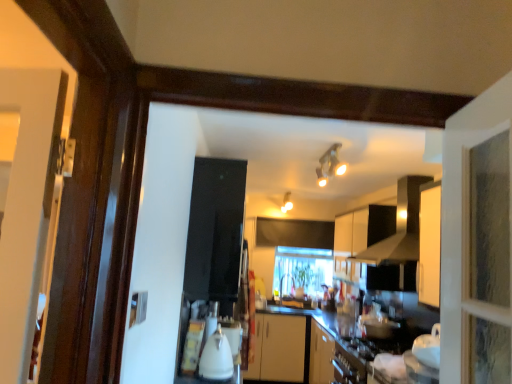
What are the coordinates of `black matte exhaust hood at upper center` in the screenshot? It's located at (400, 227).

What is the approximate height of black matte exhaust hood at upper center?

29.12 inches.

Image resolution: width=512 pixels, height=384 pixels. I want to click on white matte cabinet at upper center, so click(x=360, y=236).

What do you see at coordinates (216, 358) in the screenshot? I see `white glossy kettle at center` at bounding box center [216, 358].

How much space does matte silver light fixture at upper center, the 2th light fixture from the back, occupy vertically?

The height of matte silver light fixture at upper center, the 2th light fixture from the back, is 16.30 centimeters.

Where is `black matte exhaust hood at upper center`? This screenshot has width=512, height=384. black matte exhaust hood at upper center is located at coordinates (400, 227).

Is black matte exhaust hood at upper center in front of or behind matte white light fixture at upper center, acting as the second light fixture starting from the top, in the image?

Clearly, black matte exhaust hood at upper center is in front of matte white light fixture at upper center, acting as the second light fixture starting from the top.

Can you confirm if black matte exhaust hood at upper center is smaller than matte white light fixture at upper center, acting as the 2th light fixture starting from the right?

No.

Which object is wider, black matte exhaust hood at upper center or matte white light fixture at upper center, acting as the second light fixture starting from the top?

matte white light fixture at upper center, acting as the second light fixture starting from the top, is wider.

Is point (303, 284) closer to camera compared to point (227, 374)?

That is False.

From a real-world perspective, is clear glass window at center positioned over white glossy kettle at center based on gravity?

Yes, from a real-world perspective, clear glass window at center is over white glossy kettle at center

Is clear glass window at center next to white glossy kettle at center and touching it?

No, clear glass window at center is not in contact with white glossy kettle at center.

Based on their positions, is clear glass window at center located to the left or right of white glossy kettle at center?

In the image, clear glass window at center appears on the right side of white glossy kettle at center.

This screenshot has height=384, width=512. Find the location of `light fixture in front of the white matte cabinet at upper center`. light fixture in front of the white matte cabinet at upper center is located at coordinates (330, 165).

Between white matte cabinet at upper center and matte silver light fixture at upper center, the 2th light fixture from the back, which one appears on the left side from the viewer's perspective?

Positioned to the left is matte silver light fixture at upper center, the 2th light fixture from the back.

Does point (339, 218) lie behind point (343, 165)?

Yes.

Who is shorter, matte white light fixture at upper center, acting as the 2th light fixture starting from the right, or black matte exhaust hood at upper center?

Standing shorter between the two is matte white light fixture at upper center, acting as the 2th light fixture starting from the right.

Is matte white light fixture at upper center, the 1th light fixture in the back-to-front sequence, thinner than black matte exhaust hood at upper center?

In fact, matte white light fixture at upper center, the 1th light fixture in the back-to-front sequence, might be wider than black matte exhaust hood at upper center.

In the image, is matte white light fixture at upper center, the first light fixture in the left-to-right sequence, positioned in front of or behind black matte exhaust hood at upper center?

In the image, matte white light fixture at upper center, the first light fixture in the left-to-right sequence, appears behind black matte exhaust hood at upper center.

Which is correct: matte white light fixture at upper center, acting as the 2th light fixture starting from the right, is inside black matte exhaust hood at upper center, or outside of it?

matte white light fixture at upper center, acting as the 2th light fixture starting from the right, lies outside black matte exhaust hood at upper center.

Which of these two, white glossy kettle at center or matte white light fixture at upper center, arranged as the second light fixture when viewed from the front, stands taller?

white glossy kettle at center is taller.

Can you confirm if white glossy kettle at center is smaller than matte white light fixture at upper center, acting as the second light fixture starting from the top?

Correct, white glossy kettle at center occupies less space than matte white light fixture at upper center, acting as the second light fixture starting from the top.

Between white glossy kettle at center and matte white light fixture at upper center, the first light fixture when ordered from bottom to top, which one appears on the right side from the viewer's perspective?

matte white light fixture at upper center, the first light fixture when ordered from bottom to top, is more to the right.

Is white glossy kettle at center positioned far away from matte white light fixture at upper center, arranged as the second light fixture when viewed from the front?

Yes, white glossy kettle at center and matte white light fixture at upper center, arranged as the second light fixture when viewed from the front, are quite far apart.

From the picture: Which is more to the left, white glossy kettle at center or black matte exhaust hood at upper center?

Positioned to the left is white glossy kettle at center.

Does white glossy kettle at center have a smaller size compared to black matte exhaust hood at upper center?

Indeed, white glossy kettle at center has a smaller size compared to black matte exhaust hood at upper center.

From a real-world perspective, between white glossy kettle at center and black matte exhaust hood at upper center, who is vertically lower?

white glossy kettle at center is physically lower.

Is black matte exhaust hood at upper center completely or partially inside white glossy kettle at center?

No, white glossy kettle at center does not contain black matte exhaust hood at upper center.

Is point (314, 288) positioned in front of point (335, 157)?

That is False.

Which object is positioned more to the right, clear glass window at center or matte silver light fixture at upper center, which appears as the 2th light fixture when viewed from the left?

clear glass window at center is more to the right.

You are a GUI agent. You are given a task and a screenshot of the screen. Output one action in this format:
    pyautogui.click(x=<x>, y=<y>)
    Task: Click on the 2nd light fixture in front of the clear glass window at center, starting your count from the anchor
    
    Given the screenshot: What is the action you would take?
    pyautogui.click(x=330, y=165)

From the image's perspective, is clear glass window at center located beneath matte silver light fixture at upper center, the 2th light fixture from the back?

Yes, from the image's perspective, clear glass window at center is below matte silver light fixture at upper center, the 2th light fixture from the back.

Locate an element on the screen. Image resolution: width=512 pixels, height=384 pixels. exhaust hood in front of the matte white light fixture at upper center, acting as the second light fixture starting from the top is located at coordinates (400, 227).

Where is `appliance above the clear glass window at center (from the image's perspective)`? This screenshot has height=384, width=512. appliance above the clear glass window at center (from the image's perspective) is located at coordinates (216, 358).

Estimate the real-world distances between objects in this image. Which object is closer to matte silver light fixture at upper center, acting as the first light fixture starting from the right, clear glass window at center or white matte cabinet at upper center?

The object closer to matte silver light fixture at upper center, acting as the first light fixture starting from the right, is white matte cabinet at upper center.

Which object lies further to the anchor point matte silver light fixture at upper center, acting as the first light fixture starting from the right, white glossy kettle at center or black matte exhaust hood at upper center?

The object further to matte silver light fixture at upper center, acting as the first light fixture starting from the right, is white glossy kettle at center.

Based on their spatial positions, is white glossy kettle at center or black matte exhaust hood at upper center closer to white matte cabinet at upper center?

black matte exhaust hood at upper center.

Based on their spatial positions, is matte silver light fixture at upper center, acting as the first light fixture starting from the right, or white matte cabinet at upper center closer to matte white light fixture at upper center, the first light fixture in the left-to-right sequence?

The object closer to matte white light fixture at upper center, the first light fixture in the left-to-right sequence, is white matte cabinet at upper center.

Considering their positions, is white glossy kettle at center positioned closer to black matte exhaust hood at upper center than matte silver light fixture at upper center, which is the 2th light fixture in bottom-to-top order?

matte silver light fixture at upper center, which is the 2th light fixture in bottom-to-top order, is positioned closer to the anchor black matte exhaust hood at upper center.

Based on their spatial positions, is matte white light fixture at upper center, arranged as the second light fixture when viewed from the front, or white glossy kettle at center closer to white matte cabinet at upper center?

matte white light fixture at upper center, arranged as the second light fixture when viewed from the front.

Considering their positions, is clear glass window at center positioned further to white matte cabinet at upper center than matte silver light fixture at upper center, acting as the first light fixture starting from the right?

clear glass window at center.

Considering their positions, is white matte cabinet at upper center positioned further to black matte exhaust hood at upper center than clear glass window at center?

Among the two, clear glass window at center is located further to black matte exhaust hood at upper center.

Locate an element on the screen. This screenshot has height=384, width=512. exhaust hood located between white glossy kettle at center and matte white light fixture at upper center, the 1th light fixture in the back-to-front sequence, in the depth direction is located at coordinates (400, 227).

Where is `light fixture positioned between black matte exhaust hood at upper center and clear glass window at center from near to far`? light fixture positioned between black matte exhaust hood at upper center and clear glass window at center from near to far is located at coordinates (287, 203).

Find the location of a particular element. Image resolution: width=512 pixels, height=384 pixels. light fixture between white matte cabinet at upper center and clear glass window at center along the z-axis is located at coordinates (287, 203).

You are a GUI agent. You are given a task and a screenshot of the screen. Output one action in this format:
    pyautogui.click(x=<x>, y=<y>)
    Task: Click on the exhaust hood between matte silver light fixture at upper center, the first light fixture in the front-to-back sequence, and white matte cabinet at upper center, along the z-axis
    The height and width of the screenshot is (384, 512).
    Given the screenshot: What is the action you would take?
    pyautogui.click(x=400, y=227)